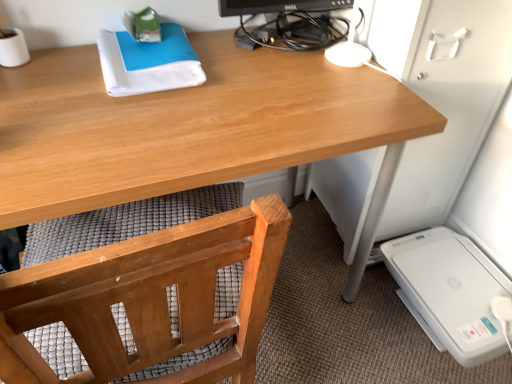
Question: Does wooden chair at lower left appear on the right side of wooden desk at center?

Choices:
 (A) no
 (B) yes

Answer: (A)

Question: Is wooden chair at lower left in front of wooden desk at center?

Choices:
 (A) no
 (B) yes

Answer: (A)

Question: Is wooden chair at lower left smaller than wooden desk at center?

Choices:
 (A) no
 (B) yes

Answer: (B)

Question: Is wooden chair at lower left not inside wooden desk at center?

Choices:
 (A) no
 (B) yes

Answer: (A)

Question: Are wooden chair at lower left and wooden desk at center making contact?

Choices:
 (A) yes
 (B) no

Answer: (B)

Question: From a real-world perspective, is wooden chair at lower left physically located above or below wooden desk at center?

Choices:
 (A) above
 (B) below

Answer: (A)

Question: From the image's perspective, is wooden chair at lower left located above or below wooden desk at center?

Choices:
 (A) below
 (B) above

Answer: (A)

Question: Considering the positions of point (202, 279) and point (283, 74), is point (202, 279) closer or farther from the camera than point (283, 74)?

Choices:
 (A) farther
 (B) closer

Answer: (B)

Question: Is wooden chair at lower left taller or shorter than wooden desk at center?

Choices:
 (A) tall
 (B) short

Answer: (B)

Question: Looking at their shapes, would you say wooden chair at lower left is wider or thinner than black glossy monitor at upper center?

Choices:
 (A) thin
 (B) wide

Answer: (B)

Question: Does point (139, 359) appear closer or farther from the camera than point (327, 26)?

Choices:
 (A) farther
 (B) closer

Answer: (B)

Question: Visually, is wooden chair at lower left positioned to the left or to the right of black glossy monitor at upper center?

Choices:
 (A) right
 (B) left

Answer: (B)

Question: Is wooden chair at lower left situated inside black glossy monitor at upper center or outside?

Choices:
 (A) inside
 (B) outside

Answer: (B)

Question: Considering the positions of white plastic printer at lower right and wooden desk at center in the image, is white plastic printer at lower right wider or thinner than wooden desk at center?

Choices:
 (A) thin
 (B) wide

Answer: (A)

Question: Considering the positions of white plastic printer at lower right and wooden desk at center in the image, is white plastic printer at lower right bigger or smaller than wooden desk at center?

Choices:
 (A) small
 (B) big

Answer: (A)